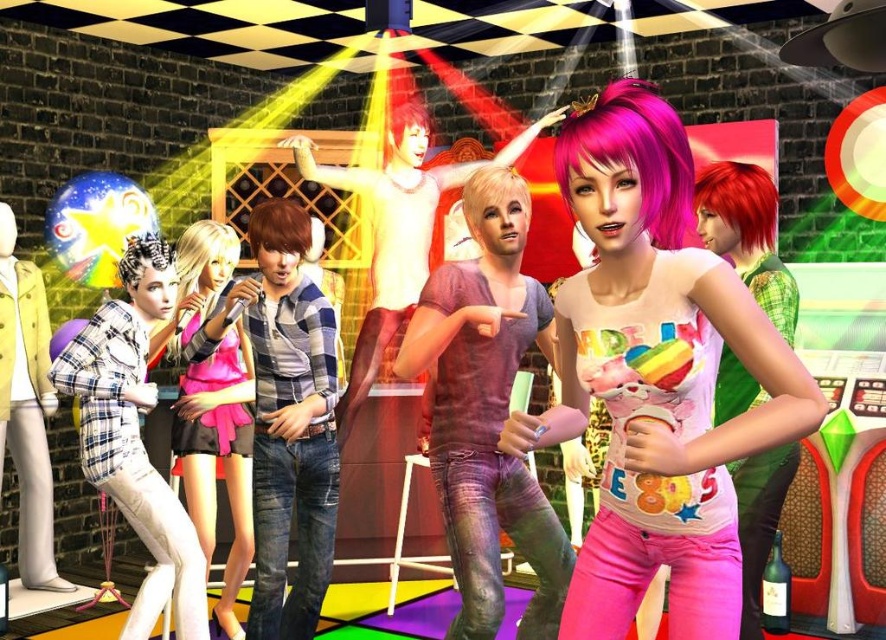
Measure the distance from purple shiny shirt at center to matte purple wig at center.

36.21 inches

Does purple shiny shirt at center appear on the right side of matte purple wig at center?

Indeed, purple shiny shirt at center is positioned on the right side of matte purple wig at center.

What do you see at coordinates (487, 412) in the screenshot? I see `purple shiny shirt at center` at bounding box center [487, 412].

Where is `purple shiny shirt at center`? The width and height of the screenshot is (886, 640). purple shiny shirt at center is located at coordinates (487, 412).

Which is in front, point (636, 557) or point (499, 323)?

Point (636, 557)

Which is more to the left, pastel rainbow t-shirt at center or purple shiny shirt at center?

Positioned to the left is purple shiny shirt at center.

Which is behind, point (622, 376) or point (483, 211)?

The point (483, 211) is behind.

Find the location of `pastel rainbow t-shirt at center`. pastel rainbow t-shirt at center is located at coordinates (657, 376).

Which of these two, purple shiny shirt at center or matte pink dress at center, stands shorter?

Standing shorter between the two is purple shiny shirt at center.

Measure the distance between purple shiny shirt at center and matte pink dress at center.

purple shiny shirt at center and matte pink dress at center are 1.38 meters apart from each other.

Which is in front, point (542, 634) or point (241, 502)?

Positioned in front is point (542, 634).

Locate an element on the screen. purple shiny shirt at center is located at coordinates (487, 412).